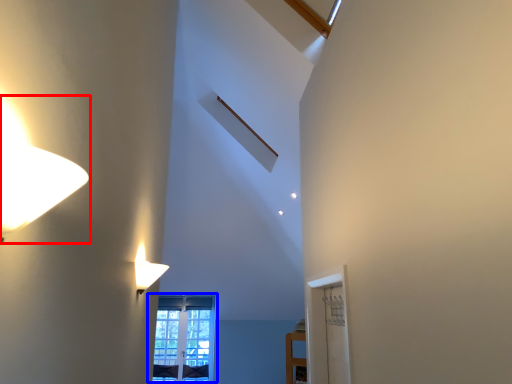
Question: Which of the following is the farthest to the observer, lamp (highlighted by a red box) or window (highlighted by a blue box)?

Choices:
 (A) lamp
 (B) window

Answer: (B)